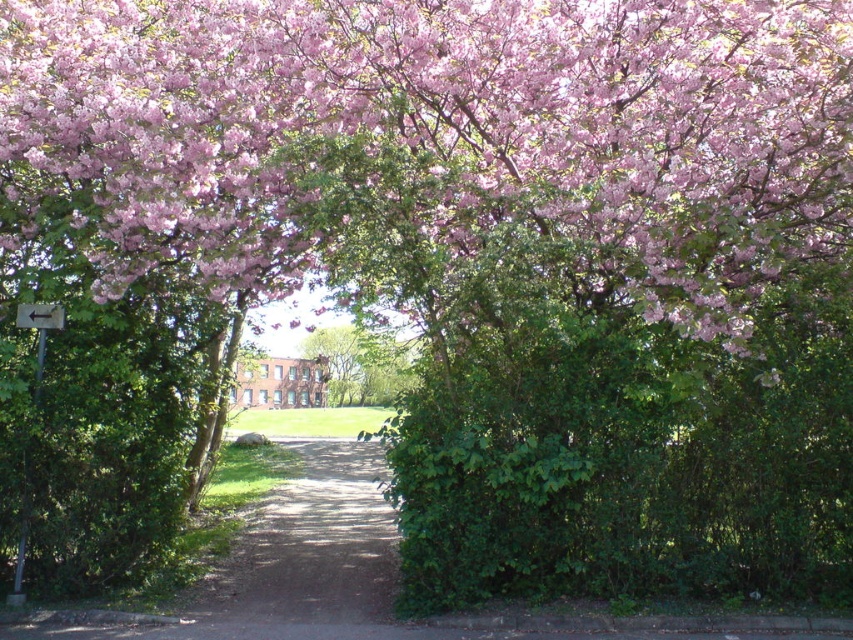
Is pink bloom at upper center smaller than green leafy tree at center?

Incorrect, pink bloom at upper center is not smaller in size than green leafy tree at center.

Can you confirm if pink bloom at upper center is positioned to the left of green leafy tree at center?

No, pink bloom at upper center is not to the left of green leafy tree at center.

Is point (846, 144) positioned behind point (378, 381)?

No, (846, 144) is closer to viewer.

Find the location of a particular element. pink bloom at upper center is located at coordinates (444, 118).

This screenshot has height=640, width=853. What are the coordinates of `pink bloom at upper center` in the screenshot? It's located at (444, 118).

Is pink bloom at upper center above dirt path at center?

Yes, pink bloom at upper center is above dirt path at center.

Is point (276, 67) closer to camera compared to point (363, 620)?

Yes, point (276, 67) is closer to viewer.

I want to click on pink bloom at upper center, so click(444, 118).

Is dirt path at center positioned at the back of green leafy tree at center?

That is False.

Is dirt path at center shorter than green leafy tree at center?

Yes.

The image size is (853, 640). What are the coordinates of `dirt path at center` in the screenshot? It's located at (306, 557).